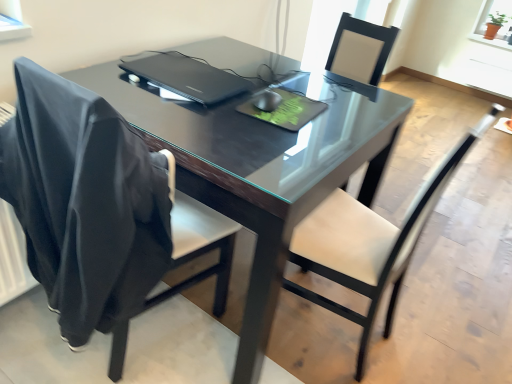
Question: Is black plastic laptop at center bigger or smaller than terracotta clay pot at upper right?

Choices:
 (A) big
 (B) small

Answer: (B)

Question: From a real-world perspective, is black plastic laptop at center above or below terracotta clay pot at upper right?

Choices:
 (A) above
 (B) below

Answer: (A)

Question: Estimate the real-world distances between objects in this image. Which object is farther from the black plastic laptop at center?

Choices:
 (A) white leather chair at center, which is the 2th chair in left-to-right order
 (B) glossy black table at center
 (C) black leather chair at left, which is the first chair in left-to-right order
 (D) terracotta clay pot at upper right

Answer: (D)

Question: Estimate the real-world distances between objects in this image. Which object is closer to the black leather chair at left, which is the first chair in left-to-right order?

Choices:
 (A) glossy black table at center
 (B) black plastic laptop at center
 (C) terracotta clay pot at upper right
 (D) white leather chair at center, which is the 1th chair from right to left

Answer: (A)